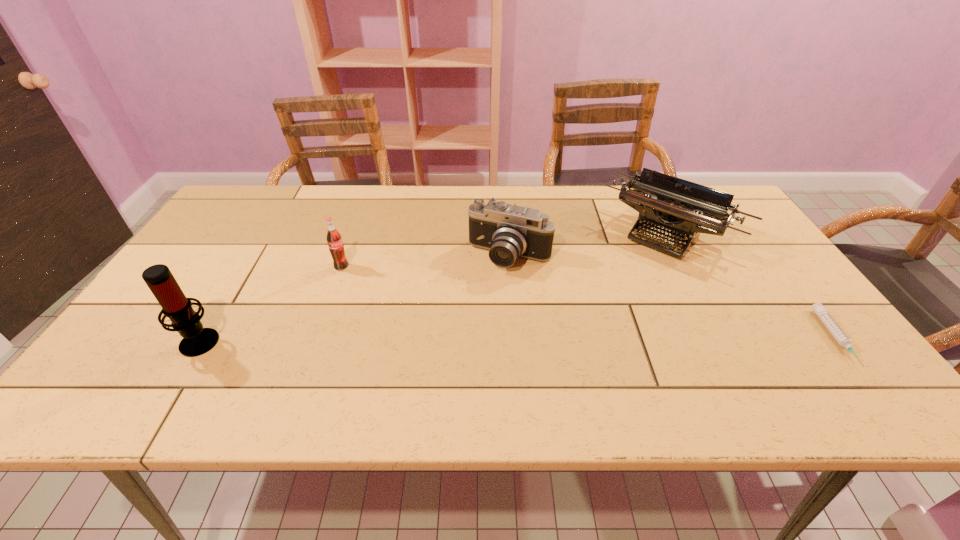
I want to click on free space on the desktop that is between the microphone and the syringe and is positioned on the label of the soda bottle, so click(x=441, y=340).

What are the coordinates of `free space on the desktop that is between the tallest object and the rightmost object and is positioned on the typing side of the typewriter` in the screenshot? It's located at (580, 339).

Identify the location of free spot on the desktop that is between the microphone and the rightmost object and is positioned on the front-facing side of the third object from right to left. The width and height of the screenshot is (960, 540). (468, 339).